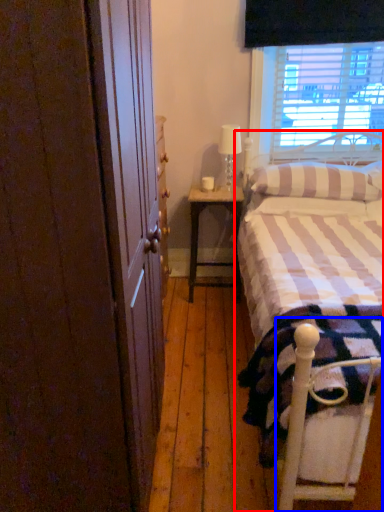
Question: Which point is further to the camera, bed (highlighted by a red box) or bed frame (highlighted by a blue box)?

Choices:
 (A) bed
 (B) bed frame

Answer: (B)